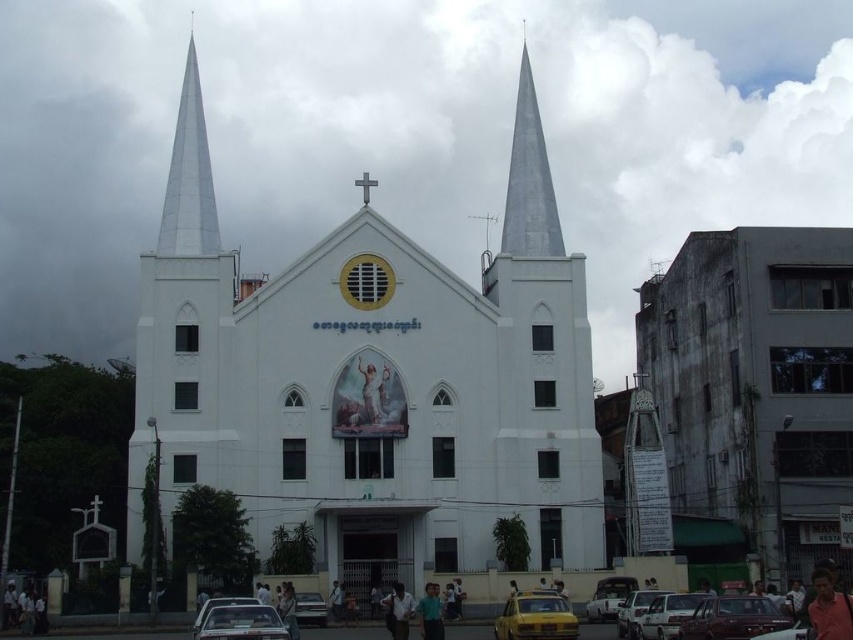
Who is positioned more to the right, white concrete church at right or yellow matte taxi at lower center?

white concrete church at right

Is white concrete church at right positioned behind yellow matte taxi at lower center?

That is True.

Does point (799, 300) lie behind point (526, 614)?

Yes, it is behind point (526, 614).

Locate an element on the screen. white concrete church at right is located at coordinates (756, 385).

Who is lower down, maroon metallic car at lower right or white matte car at center?

Positioned lower is white matte car at center.

Image resolution: width=853 pixels, height=640 pixels. I want to click on maroon metallic car at lower right, so click(x=732, y=618).

Find the location of `maroon metallic car at lower right`. maroon metallic car at lower right is located at coordinates (732, 618).

Is white metallic spire at upper left taller than white matte car at lower right?

Correct, white metallic spire at upper left is much taller as white matte car at lower right.

Which is above, white metallic spire at upper left or white matte car at lower right?

white metallic spire at upper left is higher up.

Who is more distant from viewer, (189, 49) or (693, 593)?

Positioned behind is point (189, 49).

Where is `white metallic spire at upper left`? This screenshot has height=640, width=853. white metallic spire at upper left is located at coordinates (189, 177).